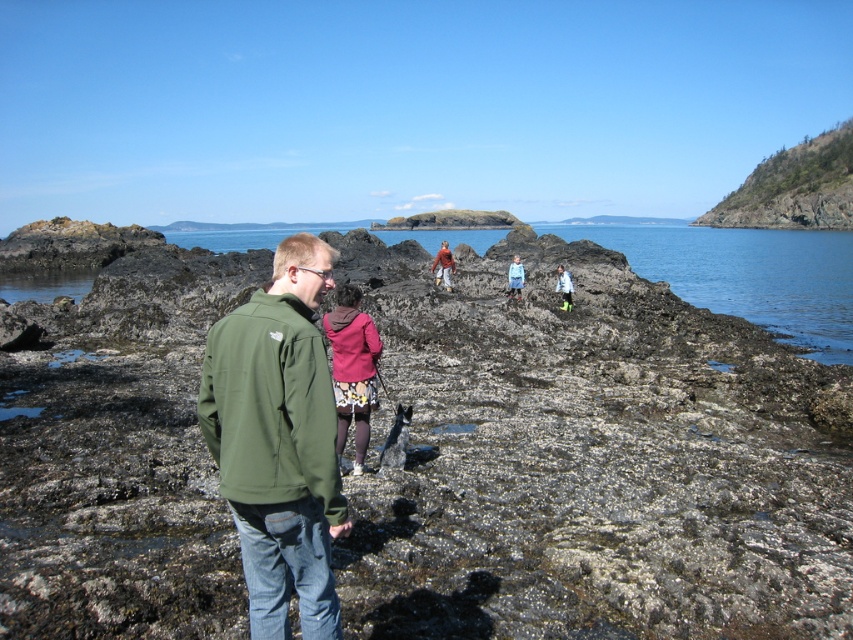
You are standing at the point marked by the coordinates point (444, 266) in the image. Looking around, you see a person in a green jacket and jeans and another in a red top and patterned skirt. Which direction should you face to see the person in the red top and patterned skirt?

The point (444, 266) marks the location of the matte red sweater at center. Since the person in the red top and patterned skirt is described as being closer to the center, facing towards the center of the image would allow you to see them.

You are a photographer trying to capture a photo of the coastal scene. You notice the matte red sweater at center and the light blue rubber boots at center. Which object is wider in the image?

The matte red sweater at center is wider than the light blue rubber boots at center according to the description.

You are standing at the edge of the rocky shoreline and want to pick up an item from the ground. The matte red sweater at center and the light blue rubber boots at center are both in your line of sight. Which item is farther away from you?

The matte red sweater at center is 6.81 meters away from the light blue rubber boots at center. Since both items are at the center, their distance from you depends on their positions relative to each other. However, the question asks which is farther from you, but the given information only specifies their distance from each other. Without knowing your exact position relative to both, we cannot determine which is farther away based on the provided data.